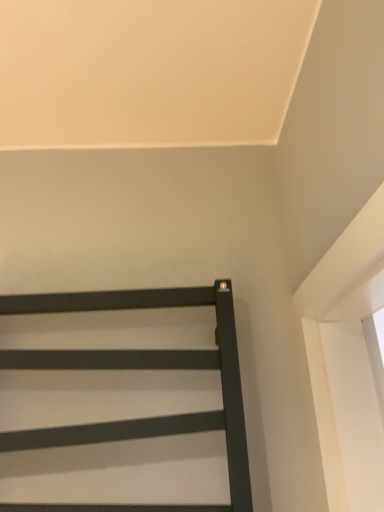
This screenshot has height=512, width=384. In order to click on matte black ladder at upper right in this screenshot , I will do (139, 368).

Measure the distance between matte black ladder at upper right and camera.

matte black ladder at upper right is 26.45 inches from camera.

What do you see at coordinates (139, 368) in the screenshot?
I see `matte black ladder at upper right` at bounding box center [139, 368].

The height and width of the screenshot is (512, 384). Identify the location of matte black ladder at upper right. tap(139, 368).